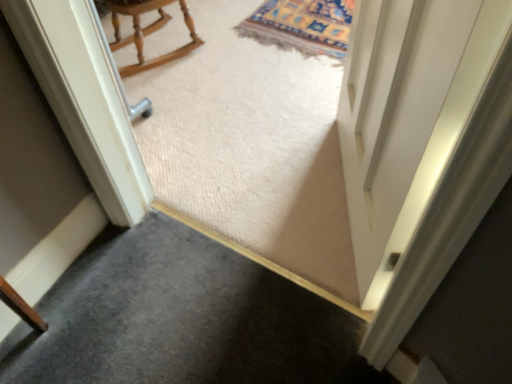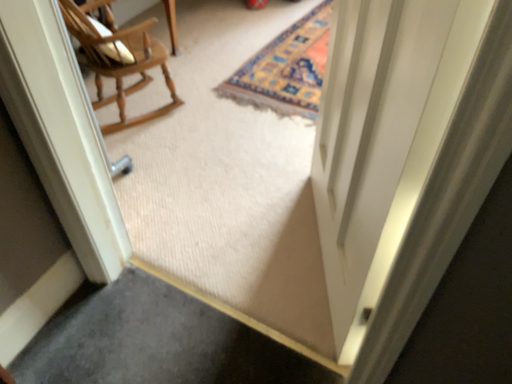
Question: Which way did the camera rotate in the video?

Choices:
 (A) rotated downward
 (B) rotated upward

Answer: (B)